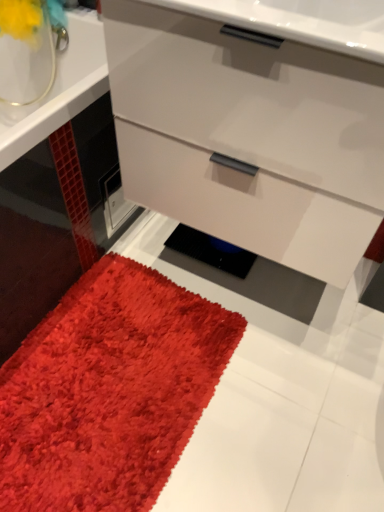
Question: Is shaggy red carpet at lower left directly adjacent to matte yellow flower at upper left?

Choices:
 (A) yes
 (B) no

Answer: (B)

Question: Are shaggy red carpet at lower left and matte yellow flower at upper left far apart?

Choices:
 (A) yes
 (B) no

Answer: (B)

Question: Is shaggy red carpet at lower left to the right of matte yellow flower at upper left from the viewer's perspective?

Choices:
 (A) yes
 (B) no

Answer: (A)

Question: Could matte yellow flower at upper left be considered to be inside shaggy red carpet at lower left?

Choices:
 (A) yes
 (B) no

Answer: (B)

Question: Does shaggy red carpet at lower left have a lesser height compared to matte yellow flower at upper left?

Choices:
 (A) yes
 (B) no

Answer: (A)

Question: Based on their positions, is shaggy red carpet at lower left located to the left or right of matte yellow flower at upper left?

Choices:
 (A) right
 (B) left

Answer: (A)

Question: Is shaggy red carpet at lower left wider or thinner than matte yellow flower at upper left?

Choices:
 (A) thin
 (B) wide

Answer: (B)

Question: Considering their positions, is shaggy red carpet at lower left located in front of or behind matte yellow flower at upper left?

Choices:
 (A) front
 (B) behind

Answer: (A)

Question: Does point (102, 329) appear closer or farther from the camera than point (8, 30)?

Choices:
 (A) farther
 (B) closer

Answer: (A)

Question: Looking at their shapes, would you say matte white chest of drawers at center is wider or thinner than shaggy red carpet at lower left?

Choices:
 (A) wide
 (B) thin

Answer: (B)

Question: In the image, is matte white chest of drawers at center positioned in front of or behind shaggy red carpet at lower left?

Choices:
 (A) behind
 (B) front

Answer: (B)

Question: Visually, is matte white chest of drawers at center positioned to the left or to the right of shaggy red carpet at lower left?

Choices:
 (A) right
 (B) left

Answer: (A)

Question: From the image's perspective, is matte white chest of drawers at center located above or below shaggy red carpet at lower left?

Choices:
 (A) above
 (B) below

Answer: (A)

Question: Is matte white chest of drawers at center wider or thinner than matte yellow flower at upper left?

Choices:
 (A) wide
 (B) thin

Answer: (A)

Question: From a real-world perspective, is matte white chest of drawers at center above or below matte yellow flower at upper left?

Choices:
 (A) below
 (B) above

Answer: (A)